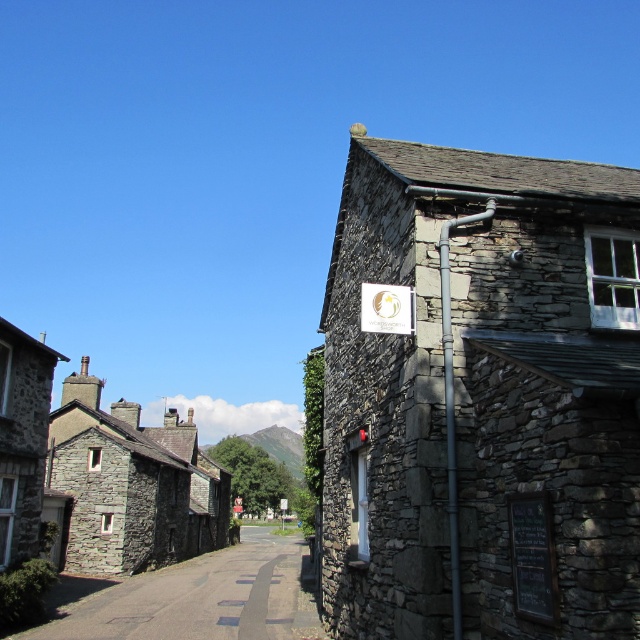
You are standing in the middle of the quaint street scene. There is a stone wall at center. Which direction should you walk to reach the Wordsworth Shop located on the right side of the image?

The stone wall at center is located at point (202, 598), so you should walk to the right side of the image to reach the Wordsworth Shop.

You are a tourist visiting this historical town and want to take a photo that includes both the gray stone building at upper right and the white plastic sign at center. Based on their sizes, which object should you position closer to the camera to ensure both are visible in the frame?

Since the gray stone building at upper right is larger than the white plastic sign at center, you should position the white plastic sign at center closer to the camera. This way, both objects will appear balanced in size within the photo frame.

You are a tourist standing on the street looking at the gray stone building at upper right and the white plastic sign at center. Which object is higher in elevation?

The gray stone building at upper right is taller than the white plastic sign at center, so the gray stone building at upper right is higher in elevation.